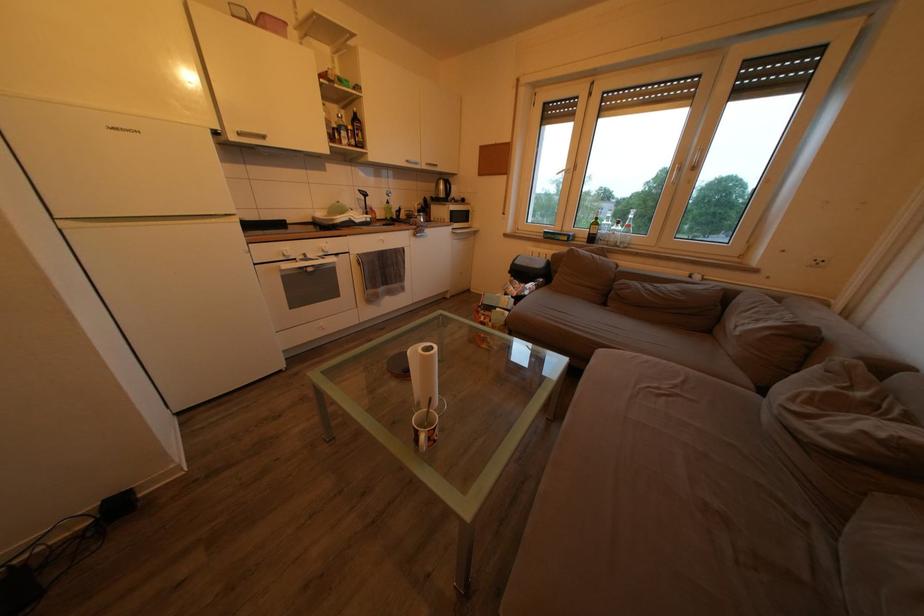
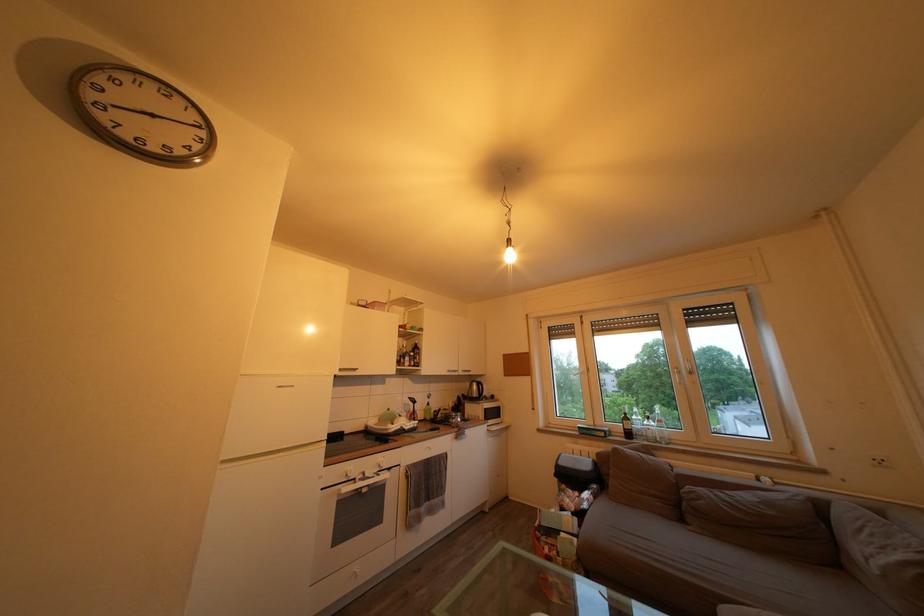
Find the pixel in the second image that matches (691,299) in the first image.

(774, 509)